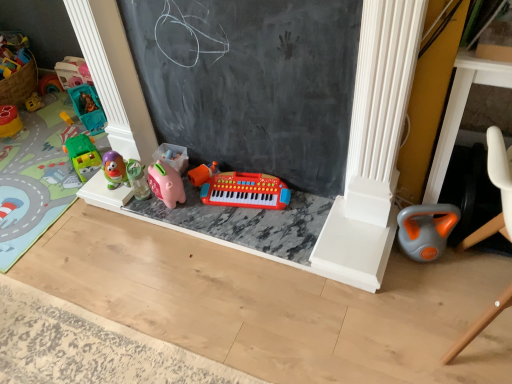
Where is `vacant space that's between green plastic car at left, the 5th toy when ordered from right to left, and rubberized green car at left, which is counted as the 7th toy, starting from the right`? vacant space that's between green plastic car at left, the 5th toy when ordered from right to left, and rubberized green car at left, which is counted as the 7th toy, starting from the right is located at coordinates (41, 147).